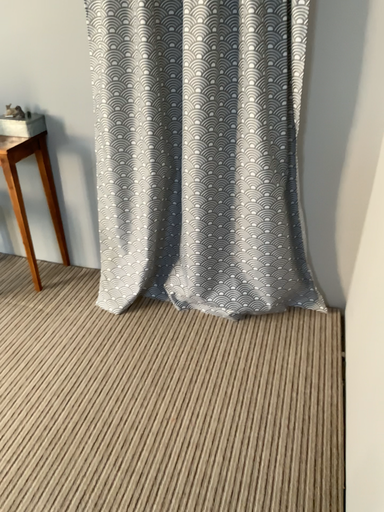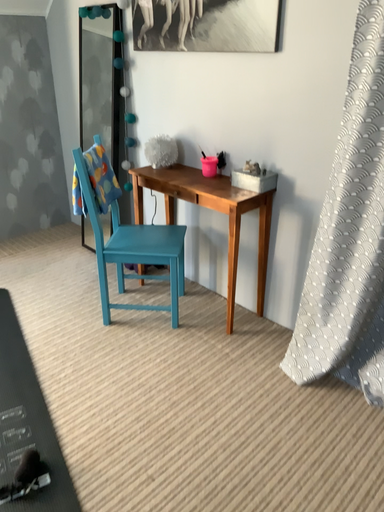
Question: How did the camera likely rotate when shooting the video?

Choices:
 (A) rotated downward
 (B) rotated upward

Answer: (B)